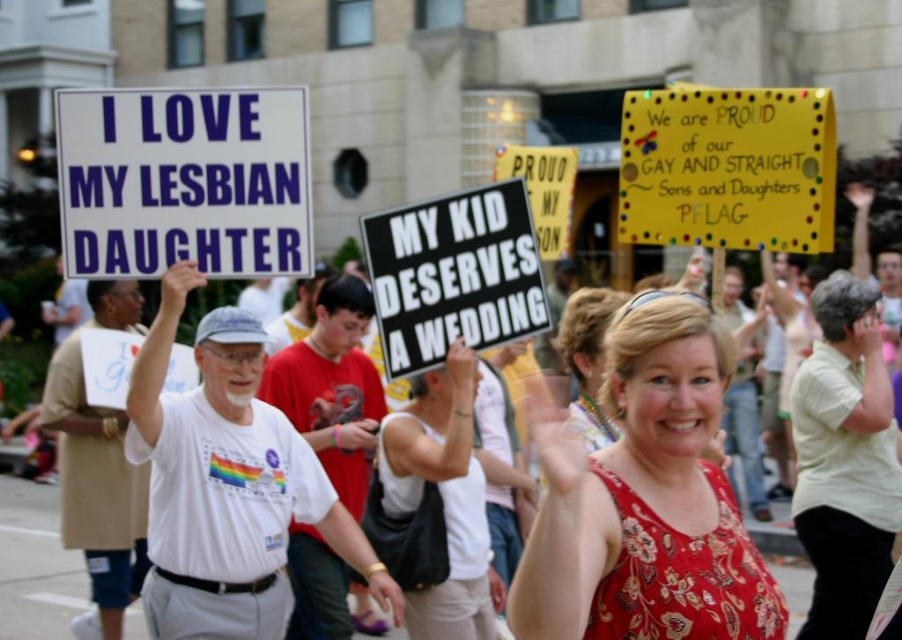
Question: Which of the following is the farthest from the observer?

Choices:
 (A) (560, 164)
 (B) (667, 161)
 (C) (623, 499)
 (D) (458, 513)

Answer: (A)

Question: Which object appears farthest from the camera in this image?

Choices:
 (A) white paper sign at upper left
 (B) floral-patterned dress at center
 (C) white tank top at center
 (D) black cardboard sign at center

Answer: (D)

Question: Observing the image, what is the correct spatial positioning of white paper sign at upper left in reference to white tank top at center?

Choices:
 (A) right
 (B) left

Answer: (B)

Question: Which object is closer to the camera taking this photo?

Choices:
 (A) white tank top at center
 (B) floral-patterned dress at center
 (C) yellow paper sign at upper center

Answer: (B)

Question: Is floral-patterned dress at center thinner than yellow paper sign at upper center?

Choices:
 (A) yes
 (B) no

Answer: (A)

Question: Does floral-patterned dress at center come behind yellow paper sign at upper center?

Choices:
 (A) no
 (B) yes

Answer: (A)